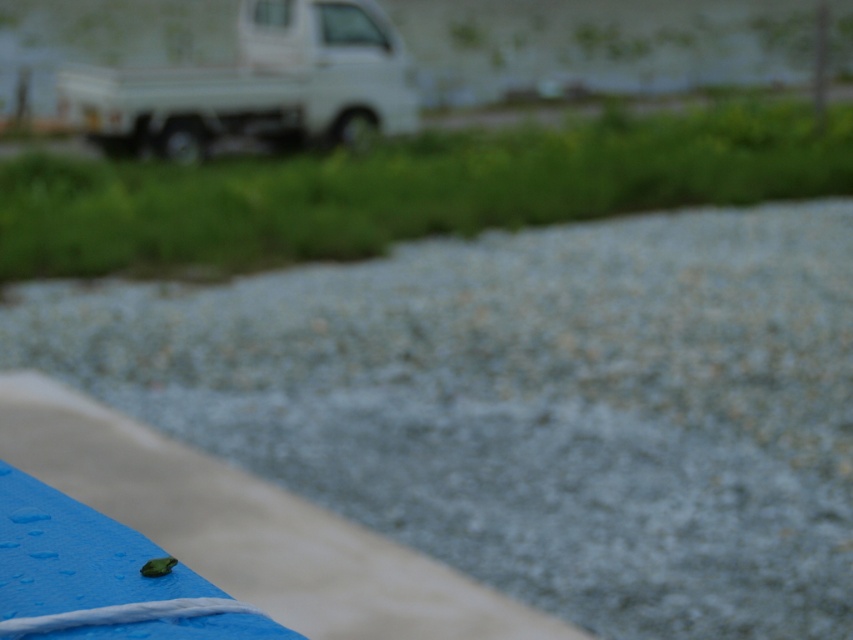
You are standing in the foreground of the image and want to move towards the background. Which point, point (141, 317) or point (224, 80), is closer to you as you start moving forward?

Point (141, 317) is closer to the viewer than point (224, 80), so it will be closer to you as you start moving forward.

You are standing on the gray gravel at center and want to reach the white matte truck at upper left. Which direction should you move to get closer to the truck?

To reach the white matte truck at upper left from the gray gravel at center, you should move towards the upper left direction since the truck is positioned in that direction relative to the gravel.

Based on the photo, you are a delivery driver who needs to park your truck on the gray gravel at center. However, the white matte truck at upper left is already parked there. Can you park your truck next to it without overlapping?

The gray gravel at center is positioned on the right side of the white matte truck at upper left. Since the gravel area is at the center and the truck is at the upper left, there might be space to park next to it, but the exact dimensions aren